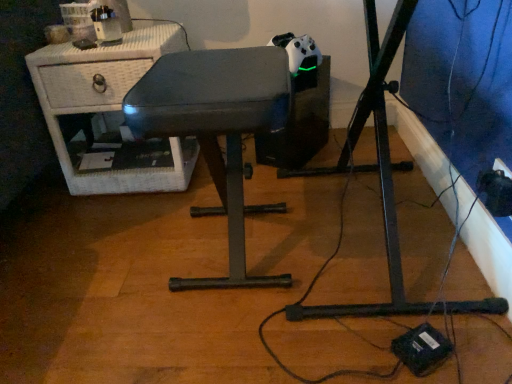
Describe the element at coordinates (111, 110) in the screenshot. The image size is (512, 384). I see `white wicker nightstand at upper left, the second furniture when ordered from front to back` at that location.

I want to click on white wicker nightstand at upper left, which is counted as the 1th furniture, starting from the left, so click(x=111, y=110).

Measure the distance between white wicker nightstand at upper left, the second furniture when ordered from front to back, and camera.

1.26 meters.

The image size is (512, 384). I want to click on metallic gray stool at center, which is counted as the first furniture, starting from the front, so coord(217,129).

This screenshot has width=512, height=384. Describe the element at coordinates (217, 129) in the screenshot. I see `metallic gray stool at center, which is counted as the first furniture, starting from the front` at that location.

What is the approximate width of metallic gray stool at center, which is counted as the first furniture, starting from the front?

The width of metallic gray stool at center, which is counted as the first furniture, starting from the front, is 14.33 inches.

Where is `white wicker nightstand at upper left, which is counted as the 1th furniture, starting from the left`? white wicker nightstand at upper left, which is counted as the 1th furniture, starting from the left is located at coordinates (111, 110).

From the picture: Is white wicker nightstand at upper left, which is counted as the 1th furniture, starting from the left, at the right side of metallic gray stool at center, the second furniture when ordered from back to front?

In fact, white wicker nightstand at upper left, which is counted as the 1th furniture, starting from the left, is to the left of metallic gray stool at center, the second furniture when ordered from back to front.

Which is in front, white wicker nightstand at upper left, the first furniture viewed from the back, or metallic gray stool at center, which is counted as the first furniture, starting from the front?

Positioned in front is metallic gray stool at center, which is counted as the first furniture, starting from the front.

Is point (113, 166) farther from viewer compared to point (153, 89)?

That is True.

From the image's perspective, which is above, white wicker nightstand at upper left, the second furniture when ordered from front to back, or metallic gray stool at center, which is counted as the first furniture, starting from the front?

white wicker nightstand at upper left, the second furniture when ordered from front to back, is shown above in the image.

From a real-world perspective, is white wicker nightstand at upper left, which is counted as the 2th furniture, starting from the right, positioned under metallic gray stool at center, which appears as the first furniture when viewed from the right, based on gravity?

Correct, in the physical world, white wicker nightstand at upper left, which is counted as the 2th furniture, starting from the right, is lower than metallic gray stool at center, which appears as the first furniture when viewed from the right.

Does white wicker nightstand at upper left, which is counted as the 1th furniture, starting from the left, have a greater width compared to metallic gray stool at center, which appears as the first furniture when viewed from the right?

Yes, white wicker nightstand at upper left, which is counted as the 1th furniture, starting from the left, is wider than metallic gray stool at center, which appears as the first furniture when viewed from the right.

Considering the sizes of white wicker nightstand at upper left, the second furniture when ordered from front to back, and metallic gray stool at center, which is counted as the first furniture, starting from the front, in the image, is white wicker nightstand at upper left, the second furniture when ordered from front to back, taller or shorter than metallic gray stool at center, which is counted as the first furniture, starting from the front,?

Considering their sizes, white wicker nightstand at upper left, the second furniture when ordered from front to back, has less height than metallic gray stool at center, which is counted as the first furniture, starting from the front.

Between white wicker nightstand at upper left, which is counted as the 2th furniture, starting from the right, and metallic gray stool at center, which appears as the first furniture when viewed from the right, which one has larger size?

white wicker nightstand at upper left, which is counted as the 2th furniture, starting from the right.

Is metallic gray stool at center, which appears as the first furniture when viewed from the right, completely or partially inside white wicker nightstand at upper left, which is counted as the 1th furniture, starting from the left?

No, metallic gray stool at center, which appears as the first furniture when viewed from the right, is not a part of white wicker nightstand at upper left, which is counted as the 1th furniture, starting from the left.

Is white wicker nightstand at upper left, the second furniture when ordered from front to back, far away from metallic gray stool at center, the second furniture when ordered from back to front?

No.

Does white wicker nightstand at upper left, the first furniture viewed from the back, turn towards metallic gray stool at center, the second furniture when ordered from back to front?

No.

Locate an element on the screen. The width and height of the screenshot is (512, 384). furniture on the left of the metallic gray stool at center, the second furniture in the left-to-right sequence is located at coordinates (111, 110).

Can you confirm if metallic gray stool at center, the second furniture in the left-to-right sequence, is positioned to the right of white wicker nightstand at upper left, which is counted as the 1th furniture, starting from the left?

Indeed, metallic gray stool at center, the second furniture in the left-to-right sequence, is positioned on the right side of white wicker nightstand at upper left, which is counted as the 1th furniture, starting from the left.

Is metallic gray stool at center, the second furniture when ordered from back to front, in front of or behind white wicker nightstand at upper left, which is counted as the 2th furniture, starting from the right, in the image?

Visually, metallic gray stool at center, the second furniture when ordered from back to front, is located in front of white wicker nightstand at upper left, which is counted as the 2th furniture, starting from the right.

Considering the positions of points (247, 105) and (166, 34), is point (247, 105) closer to camera compared to point (166, 34)?

Yes, it is in front of point (166, 34).

From the image's perspective, is metallic gray stool at center, which appears as the first furniture when viewed from the right, over white wicker nightstand at upper left, the second furniture when ordered from front to back?

No, from the image's perspective, metallic gray stool at center, which appears as the first furniture when viewed from the right, is not above white wicker nightstand at upper left, the second furniture when ordered from front to back.

From a real-world perspective, does metallic gray stool at center, which appears as the first furniture when viewed from the right, stand above white wicker nightstand at upper left, which is counted as the 2th furniture, starting from the right?

Yes, from a real-world perspective, metallic gray stool at center, which appears as the first furniture when viewed from the right, is above white wicker nightstand at upper left, which is counted as the 2th furniture, starting from the right.

Can you confirm if metallic gray stool at center, the second furniture when ordered from back to front, is thinner than white wicker nightstand at upper left, which is counted as the 2th furniture, starting from the right?

Yes.

Can you confirm if metallic gray stool at center, the second furniture when ordered from back to front, is taller than white wicker nightstand at upper left, the first furniture viewed from the back?

Yes, metallic gray stool at center, the second furniture when ordered from back to front, is taller than white wicker nightstand at upper left, the first furniture viewed from the back.

Can you confirm if metallic gray stool at center, the second furniture in the left-to-right sequence, is bigger than white wicker nightstand at upper left, which is counted as the 2th furniture, starting from the right?

No, metallic gray stool at center, the second furniture in the left-to-right sequence, is not bigger than white wicker nightstand at upper left, which is counted as the 2th furniture, starting from the right.

Is white wicker nightstand at upper left, the second furniture when ordered from front to back, inside metallic gray stool at center, the second furniture when ordered from back to front?

No, white wicker nightstand at upper left, the second furniture when ordered from front to back, is not surrounded by metallic gray stool at center, the second furniture when ordered from back to front.

Is metallic gray stool at center, which appears as the first furniture when viewed from the right, touching white wicker nightstand at upper left, which is counted as the 1th furniture, starting from the left?

No, metallic gray stool at center, which appears as the first furniture when viewed from the right, is not next to white wicker nightstand at upper left, which is counted as the 1th furniture, starting from the left.

Based on the photo, is metallic gray stool at center, which is counted as the first furniture, starting from the front, facing towards white wicker nightstand at upper left, the first furniture viewed from the back?

No, metallic gray stool at center, which is counted as the first furniture, starting from the front, is not aimed at white wicker nightstand at upper left, the first furniture viewed from the back.

Can you tell me how much metallic gray stool at center, which is counted as the first furniture, starting from the front, and white wicker nightstand at upper left, the second furniture when ordered from front to back, differ in facing direction?

There is a 90.7-degree angle between the facing directions of metallic gray stool at center, which is counted as the first furniture, starting from the front, and white wicker nightstand at upper left, the second furniture when ordered from front to back.

Could you measure the distance between metallic gray stool at center, which is counted as the first furniture, starting from the front, and white wicker nightstand at upper left, the first furniture viewed from the back?

They are 14.23 inches apart.

Find the location of `furniture below the white wicker nightstand at upper left, the first furniture viewed from the back (from the image's perspective)`. furniture below the white wicker nightstand at upper left, the first furniture viewed from the back (from the image's perspective) is located at coordinates (217, 129).

Identify the location of furniture in front of the white wicker nightstand at upper left, which is counted as the 1th furniture, starting from the left. Image resolution: width=512 pixels, height=384 pixels. (217, 129).

Identify the location of furniture above the metallic gray stool at center, which is counted as the first furniture, starting from the front (from the image's perspective). This screenshot has height=384, width=512. (111, 110).